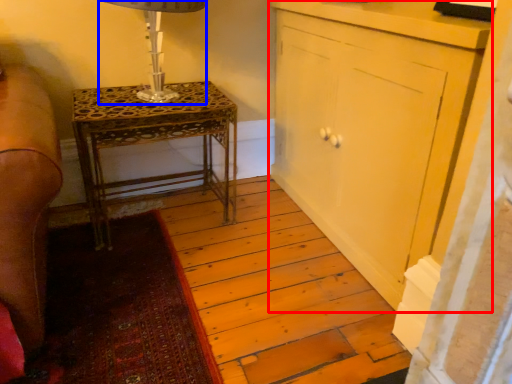
Question: Among these objects, which one is nearest to the camera, cabinetry (highlighted by a red box) or table lamp (highlighted by a blue box)?

Choices:
 (A) cabinetry
 (B) table lamp

Answer: (A)